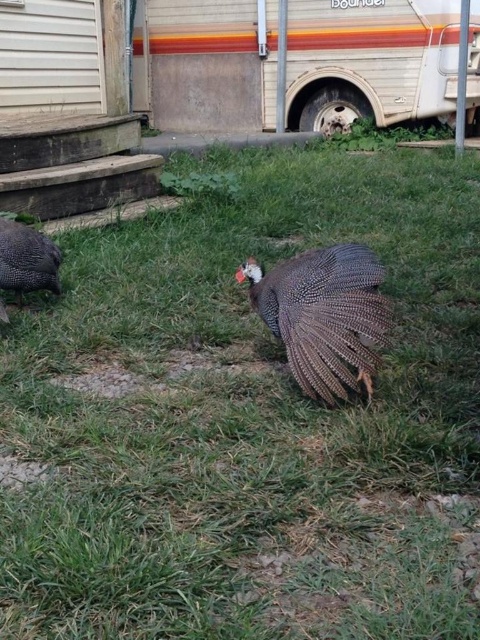
Question: Is brown speckled feathers at center bigger than brown speckled turkey at left?

Choices:
 (A) no
 (B) yes

Answer: (B)

Question: Which object appears closest to the camera in this image?

Choices:
 (A) rustic wood recreational vehicle at center
 (B) brown speckled feathers at center

Answer: (B)

Question: Does rustic wood recreational vehicle at center have a larger size compared to brown speckled turkey at left?

Choices:
 (A) no
 (B) yes

Answer: (B)

Question: Can you confirm if rustic wood recreational vehicle at center is smaller than brown speckled feathers at center?

Choices:
 (A) no
 (B) yes

Answer: (A)

Question: Considering the real-world distances, which object is closest to the brown speckled feathers at center?

Choices:
 (A) rustic wood recreational vehicle at center
 (B) brown speckled turkey at left

Answer: (B)

Question: Which object is closer to the camera taking this photo?

Choices:
 (A) brown speckled turkey at left
 (B) brown speckled feathers at center

Answer: (B)